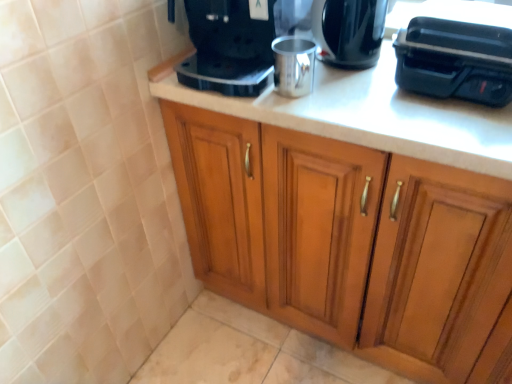
Question: Does black plastic toaster at upper right, the 2th appliance positioned from the left, have a lesser height compared to satin black coffee maker at upper center?

Choices:
 (A) no
 (B) yes

Answer: (B)

Question: Is black plastic toaster at upper right, acting as the 1th appliance starting from the right, thinner than satin black coffee maker at upper center?

Choices:
 (A) no
 (B) yes

Answer: (B)

Question: Is black plastic toaster at upper right, acting as the 1th appliance starting from the right, taller than satin black coffee maker at upper center?

Choices:
 (A) yes
 (B) no

Answer: (B)

Question: Does black plastic toaster at upper right, acting as the 1th appliance starting from the right, have a larger size compared to satin black coffee maker at upper center?

Choices:
 (A) yes
 (B) no

Answer: (B)

Question: Considering the relative positions of black plastic toaster at upper right, the 2th appliance positioned from the left, and satin black coffee maker at upper center in the image provided, is black plastic toaster at upper right, the 2th appliance positioned from the left, to the right of satin black coffee maker at upper center from the viewer's perspective?

Choices:
 (A) no
 (B) yes

Answer: (B)

Question: Relative to silver metallic cup at center, positioned as the second appliance in right-to-left order, is shiny black coffee maker at upper center in front or behind?

Choices:
 (A) front
 (B) behind

Answer: (B)

Question: Looking at their shapes, would you say shiny black coffee maker at upper center is wider or thinner than silver metallic cup at center, the first appliance from the left?

Choices:
 (A) thin
 (B) wide

Answer: (B)

Question: Does point (337, 18) appear closer or farther from the camera than point (285, 49)?

Choices:
 (A) farther
 (B) closer

Answer: (A)

Question: Is shiny black coffee maker at upper center to the left or to the right of silver metallic cup at center, the first appliance from the left, in the image?

Choices:
 (A) left
 (B) right

Answer: (B)

Question: Is black plastic toaster at upper right, the 2th appliance positioned from the left, inside or outside of shiny black coffee maker at upper center?

Choices:
 (A) inside
 (B) outside

Answer: (B)

Question: In terms of height, does black plastic toaster at upper right, acting as the 1th appliance starting from the right, look taller or shorter compared to shiny black coffee maker at upper center?

Choices:
 (A) tall
 (B) short

Answer: (B)

Question: Looking at their shapes, would you say black plastic toaster at upper right, acting as the 1th appliance starting from the right, is wider or thinner than shiny black coffee maker at upper center?

Choices:
 (A) thin
 (B) wide

Answer: (B)

Question: Considering the positions of black plastic toaster at upper right, the 2th appliance positioned from the left, and shiny black coffee maker at upper center in the image, is black plastic toaster at upper right, the 2th appliance positioned from the left, bigger or smaller than shiny black coffee maker at upper center?

Choices:
 (A) big
 (B) small

Answer: (A)

Question: Is point (272, 281) positioned closer to the camera than point (455, 43)?

Choices:
 (A) farther
 (B) closer

Answer: (A)

Question: Is wooden cabinet at center taller or shorter than black plastic toaster at upper right, acting as the 1th appliance starting from the right?

Choices:
 (A) short
 (B) tall

Answer: (B)